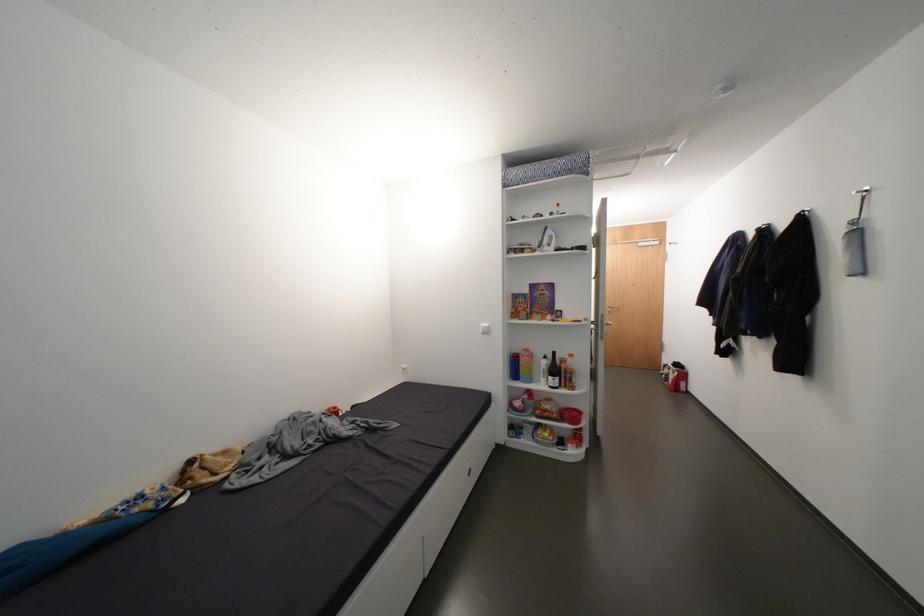
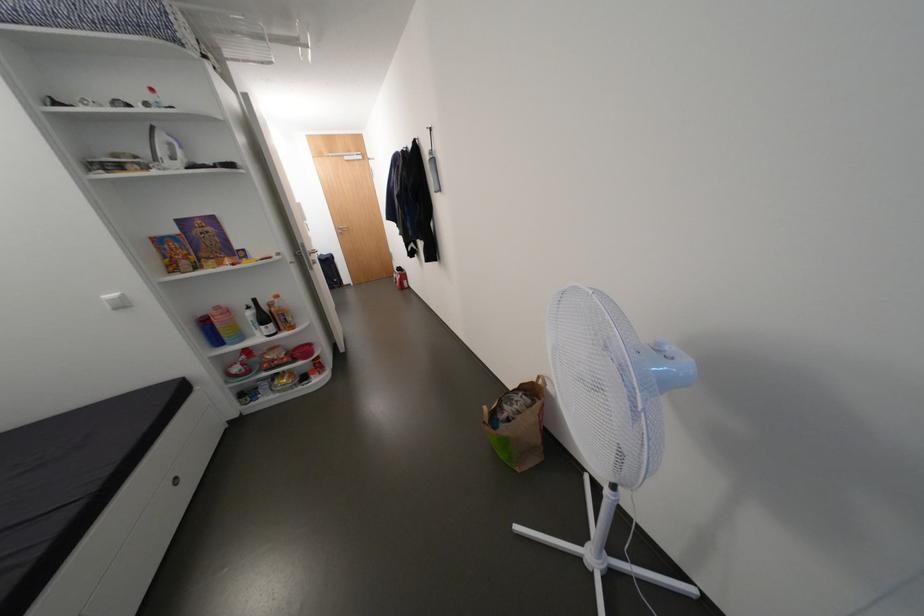
Find the pixel in the second image that matches (x=679, y=365) in the first image.

(405, 270)